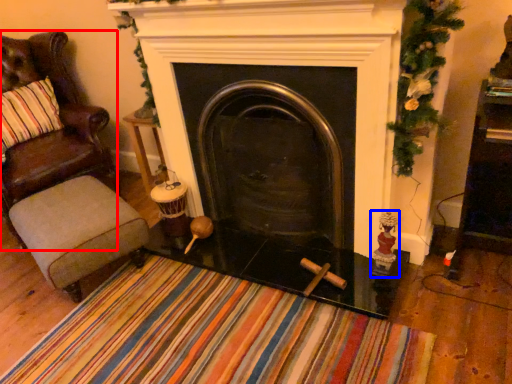
Question: Which point is further to the camera, chair (highlighted by a red box) or toy (highlighted by a blue box)?

Choices:
 (A) chair
 (B) toy

Answer: (A)